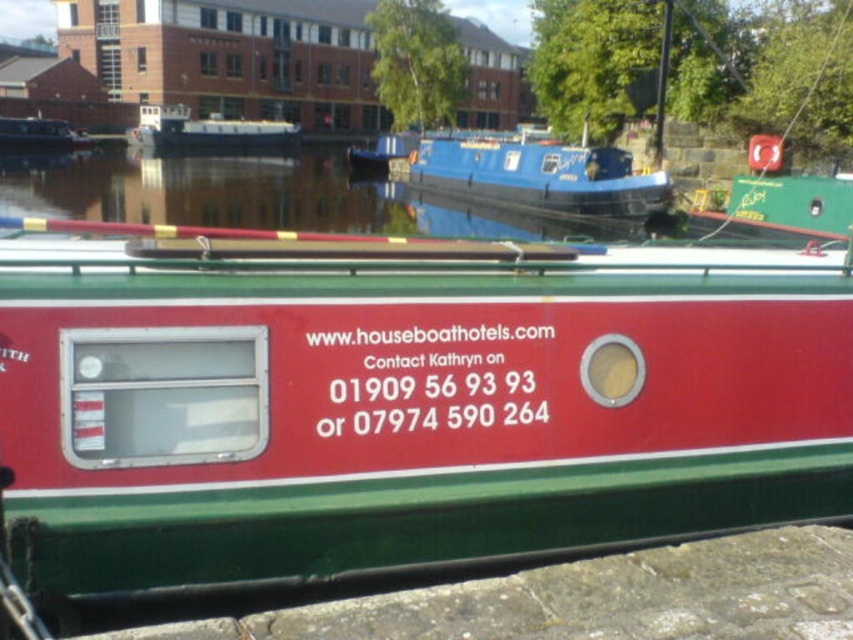
You are standing on the canal bank and want to take a photo of both the matte red boat at center and the white glossy houseboat at center. Which boat should you focus on first to ensure both are in clear view?

You should focus on the matte red boat at center first since it is closer to you than the white glossy houseboat at center, ensuring both remain in clear view as you adjust the focus.

You are navigating a small drone over the canal scene. Your drone is currently above the point at coordinates point [97,353] and needs to fly towards the point [466,166]. According to the scene, will the drone pass over any obstacles between these two points?

Point [97,353] is in front of point [466,166], so the drone will not pass over any obstacles between them because the first point is closer to the viewer and the second point is further back, meaning there is a clear path along the canal.

You are a tourist standing on the dock and want to take a photo of the matte red boat at center and the white glossy houseboat at center. Which boat should you aim your camera at first if you want to capture both in one shot without moving the camera?

The matte red boat at center is located below the white glossy houseboat at center, so you should aim your camera at the white glossy houseboat at center first to ensure both are in the frame.